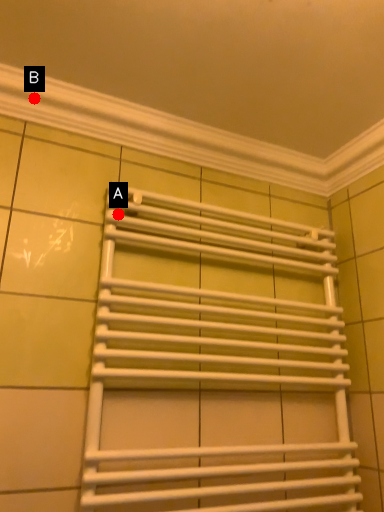
Question: Two points are circled on the image, labeled by A and B beside each circle. Which point is farther from the camera taking this photo?

Choices:
 (A) A is further
 (B) B is further

Answer: (A)